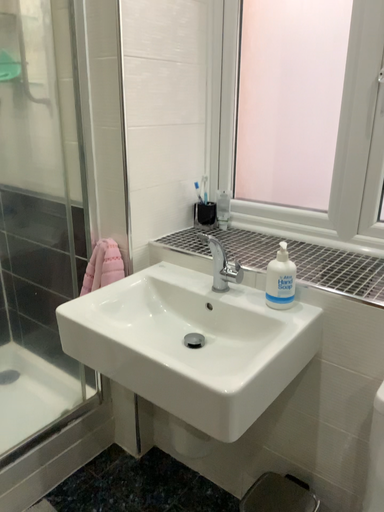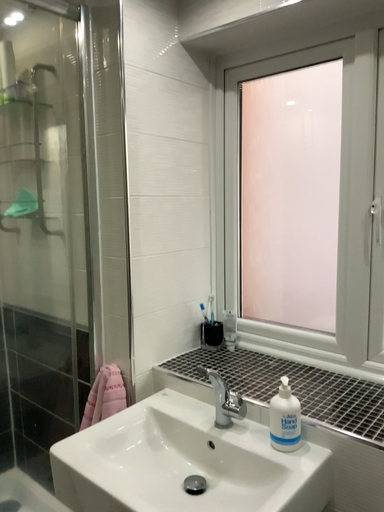
Question: How did the camera likely rotate when shooting the video?

Choices:
 (A) rotated downward
 (B) rotated upward

Answer: (B)